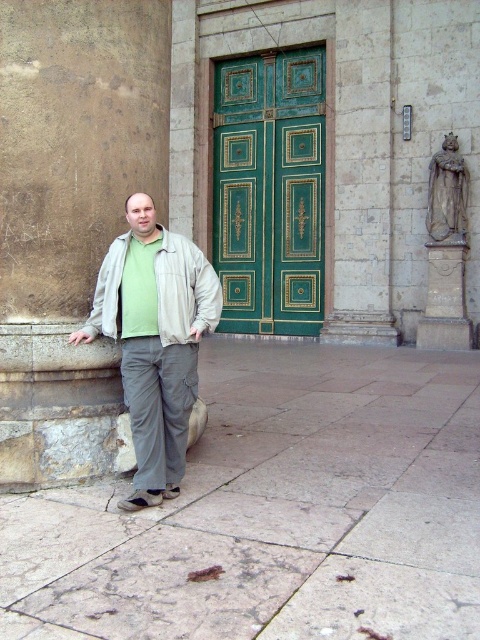
In the scene shown: Based on the scene description, can you determine which clothing item is closer to the ground between the light gray cotton pants at center and the beige fabric jacket at center?

The light gray cotton pants at center is positioned under the beige fabric jacket at center, so the light gray cotton pants at center is closer to the ground.

You are a tailor measuring the clothing of the man in the image. The light gray cotton pants at center and beige fabric jacket at center need to be altered. Can you determine if the jacket is longer than the pants?

The distance between the light gray cotton pants at center and beige fabric jacket at center is 13.48 inches, but this measurement indicates the separation between them, not their individual lengths. Therefore, the information provided does not allow determining if the jacket is longer than the pants.

You are a delivery person needing to park your 1.2 meter wide cart. You see the gray stone pavement at lower center and the green polished wood door at center. Which area can accommodate your cart?

The gray stone pavement at lower center has a greater width than the green polished wood door at center, so the cart can be parked on the gray stone pavement at lower center.